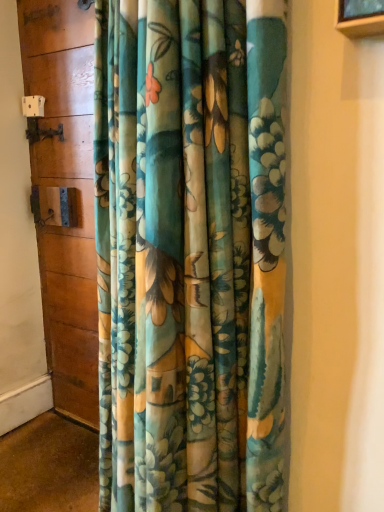
Image resolution: width=384 pixels, height=512 pixels. What are the coordinates of `vacant area that is in front of wooden door at left` in the screenshot? It's located at (62, 458).